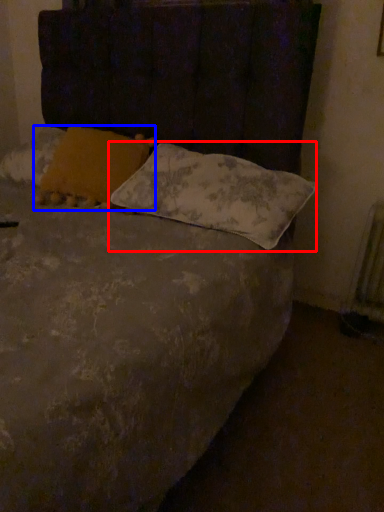
Question: Which object is closer to the camera taking this photo, pillow (highlighted by a red box) or pillow (highlighted by a blue box)?

Choices:
 (A) pillow
 (B) pillow

Answer: (A)